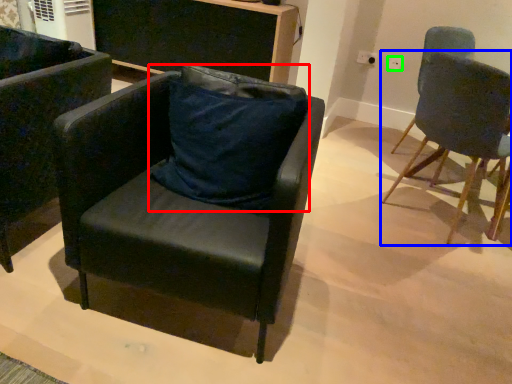
Question: Which object is the farthest from pillow (highlighted by a red box)? Choose among these: chair (highlighted by a blue box) or power outlet (highlighted by a green box).

Choices:
 (A) chair
 (B) power outlet

Answer: (B)